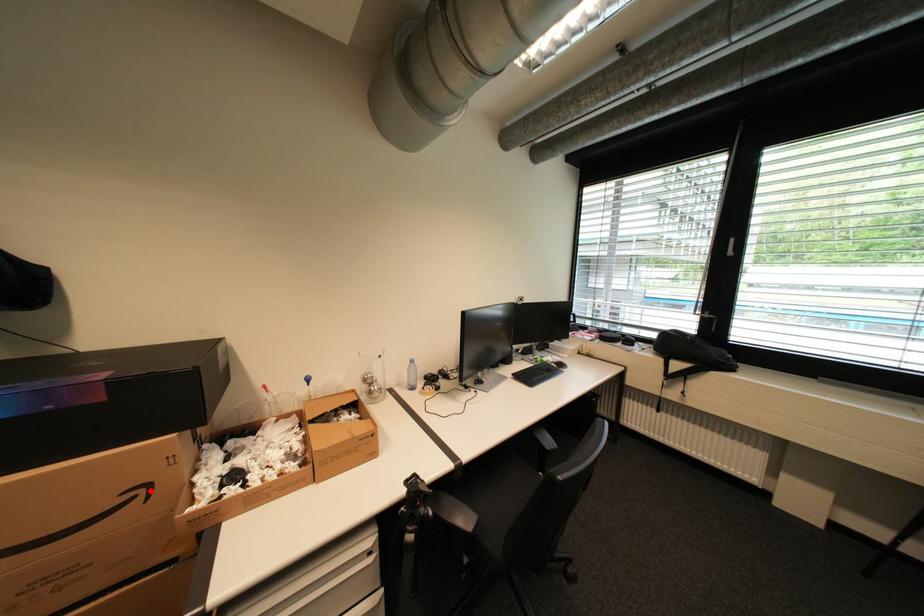
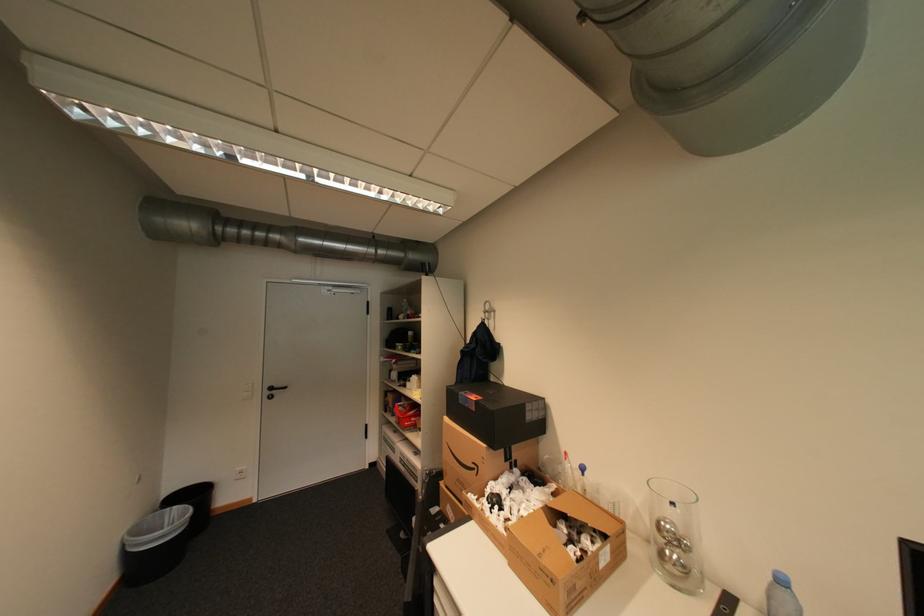
Question: I am providing you with two images of the same scene from different viewpoints. Image1 has a red point marked. In image2, the corresponding 3D location appears at what relative position? Reply with the corresponding letter.

Choices:
 (A) Closer
 (B) Farther

Answer: (B)